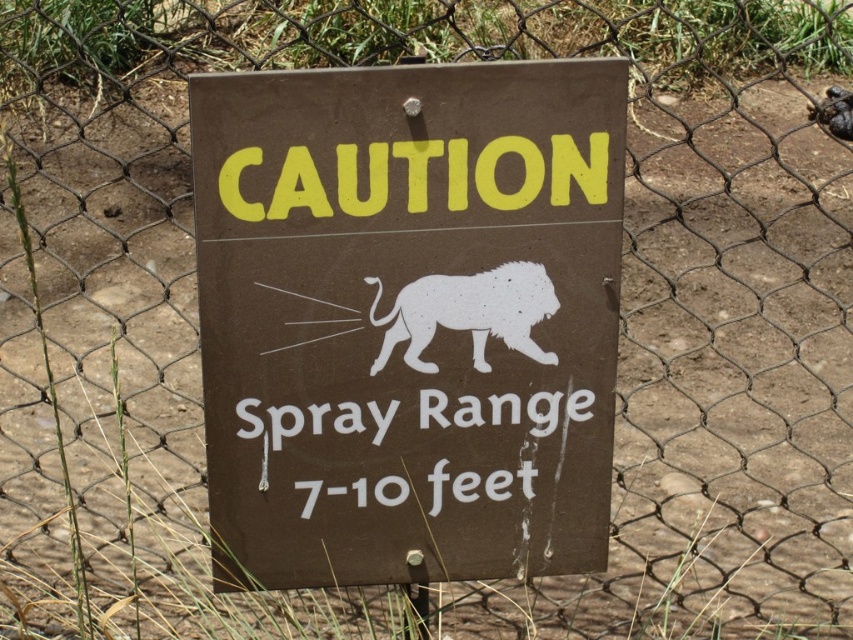
Question: Which point is farther from the camera taking this photo?

Choices:
 (A) (312, 218)
 (B) (445, 321)

Answer: (B)

Question: Is the position of brown matte sign at center more distant than that of white matte lion at center?

Choices:
 (A) no
 (B) yes

Answer: (A)

Question: Which point is closer to the camera taking this photo?

Choices:
 (A) (477, 352)
 (B) (242, 458)

Answer: (A)

Question: Which object appears closest to the camera in this image?

Choices:
 (A) brown matte sign at center
 (B) white matte lion at center

Answer: (A)

Question: Is brown matte sign at center below white matte lion at center?

Choices:
 (A) no
 (B) yes

Answer: (B)

Question: Can you confirm if brown matte sign at center is positioned to the left of white matte lion at center?

Choices:
 (A) no
 (B) yes

Answer: (B)